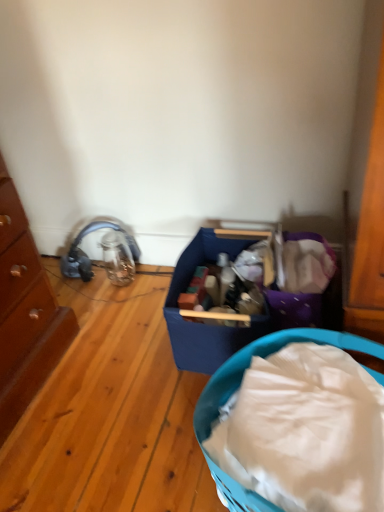
Question: Can you confirm if blue plastic basket at center is smaller than wooden chest of drawers at left?

Choices:
 (A) yes
 (B) no

Answer: (A)

Question: Is blue plastic basket at center oriented towards wooden chest of drawers at left?

Choices:
 (A) no
 (B) yes

Answer: (A)

Question: From a real-world perspective, is blue plastic basket at center located beneath wooden chest of drawers at left?

Choices:
 (A) yes
 (B) no

Answer: (A)

Question: Would you say blue plastic basket at center is outside wooden chest of drawers at left?

Choices:
 (A) yes
 (B) no

Answer: (A)

Question: From the image's perspective, is blue plastic basket at center beneath wooden chest of drawers at left?

Choices:
 (A) no
 (B) yes

Answer: (B)

Question: Can you confirm if blue plastic basket at center is taller than wooden chest of drawers at left?

Choices:
 (A) no
 (B) yes

Answer: (A)

Question: Considering the relative sizes of wooden chest of drawers at left and blue plastic basket at center in the image provided, is wooden chest of drawers at left wider than blue plastic basket at center?

Choices:
 (A) no
 (B) yes

Answer: (A)

Question: Can you confirm if wooden chest of drawers at left is taller than blue plastic basket at center?

Choices:
 (A) yes
 (B) no

Answer: (A)

Question: Is blue plastic basket at center surrounded by wooden chest of drawers at left?

Choices:
 (A) yes
 (B) no

Answer: (B)

Question: From the image's perspective, would you say wooden chest of drawers at left is shown under blue plastic basket at center?

Choices:
 (A) yes
 (B) no

Answer: (B)

Question: Are wooden chest of drawers at left and blue plastic basket at center far apart?

Choices:
 (A) yes
 (B) no

Answer: (B)

Question: Can you confirm if wooden chest of drawers at left is bigger than blue plastic basket at center?

Choices:
 (A) no
 (B) yes

Answer: (B)

Question: From the image's perspective, is wooden chest of drawers at left located above or below blue plastic basket at center?

Choices:
 (A) above
 (B) below

Answer: (A)